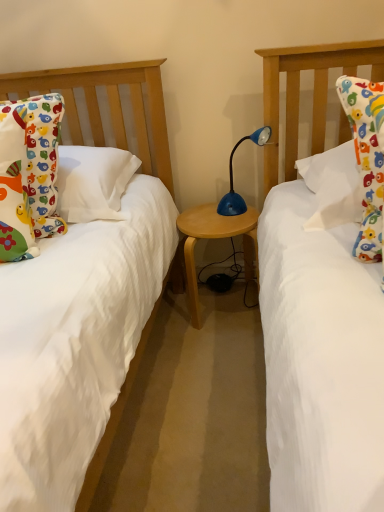
Find the location of a particular element. The height and width of the screenshot is (512, 384). vacant space in front of blue plastic lamp at center is located at coordinates (231, 224).